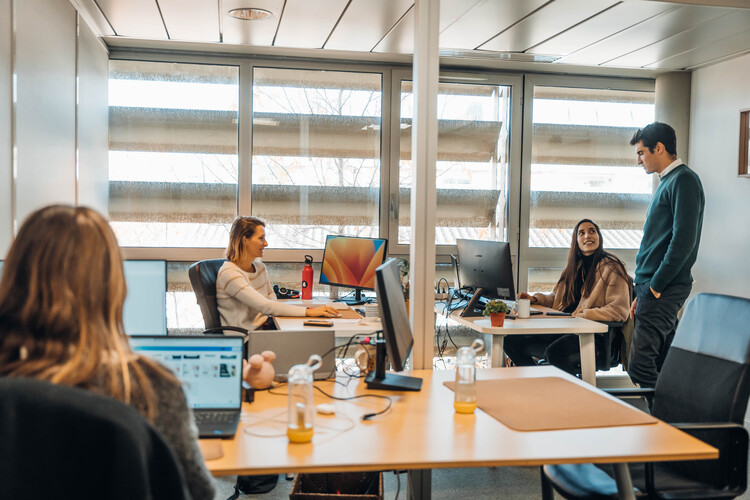
Where is `chairs`? This screenshot has width=750, height=500. chairs is located at coordinates (717, 353), (631, 292), (211, 303), (133, 461).